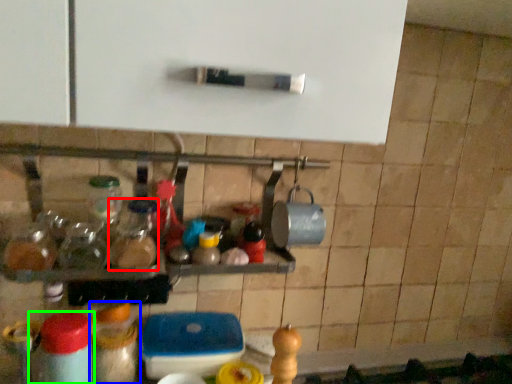
Question: Estimate the real-world distances between objects in this image. Which object is farther from bottle (highlighted by a red box), bottle (highlighted by a blue box) or bottle (highlighted by a green box)?

Choices:
 (A) bottle
 (B) bottle

Answer: (B)